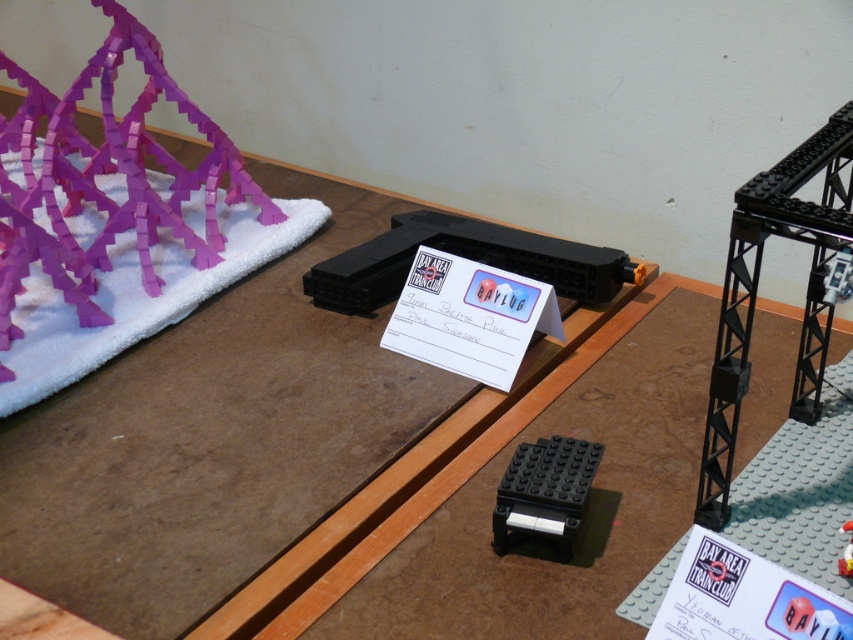
Which of these two, purple plastic structure at upper left or black matte platform at center, stands taller?

Standing taller between the two is purple plastic structure at upper left.

Does purple plastic structure at upper left have a greater height compared to black matte platform at center?

Yes.

Which is behind, point (138, 140) or point (546, 438)?

Point (138, 140)

I want to click on purple plastic structure at upper left, so click(x=107, y=173).

Does purple plastic structure at upper left have a greater height compared to black plastic train car at center?

Yes, purple plastic structure at upper left is taller than black plastic train car at center.

You are a GUI agent. You are given a task and a screenshot of the screen. Output one action in this format:
    pyautogui.click(x=<x>, y=<y>)
    Task: Click on the purple plastic structure at upper left
    
    Given the screenshot: What is the action you would take?
    pyautogui.click(x=107, y=173)

Locate an element on the screen. The width and height of the screenshot is (853, 640). purple plastic structure at upper left is located at coordinates (107, 173).

Does purple plastic structure at upper left have a larger size compared to white glossy toy at center?

Correct, purple plastic structure at upper left is larger in size than white glossy toy at center.

Does point (9, 132) come behind point (849, 520)?

Yes, it is.

Locate an element on the screen. purple plastic structure at upper left is located at coordinates (107, 173).